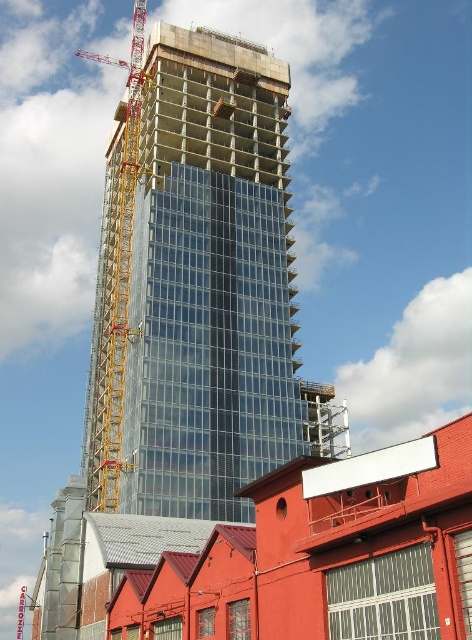
You are a delivery drone with a package that requires a 10 meter clearance to land safely. You are currently hovering between the transparent glass building at center and the yellow metallic crane at left. Can you safely land here?

The distance between the transparent glass building at center and the yellow metallic crane at left is 9.25 meters. Since the required clearance is 10 meters, the drone cannot safely land here as the available space is insufficient.

You are an architect reviewing a city planning proposal. The city requires that all new buildings must not block the view of the historic red industrial building from the main road. Given the transparent glass building at center and the yellow metallic crane at left in the scene, which one is more likely to obstruct the view of the historic building?

The yellow metallic crane at left occupies more space than the transparent glass building at center, so it is more likely to obstruct the view of the historic red industrial building.

You are a construction worker standing at the base of the transparent glass building at center and want to move to the yellow metallic crane at left. Which direction should you walk to reach the crane without going around the building?

Since the transparent glass building at center is in front of the yellow metallic crane at left, you should walk to the left side of the transparent glass building at center to reach the yellow metallic crane at left without going around the entire building.